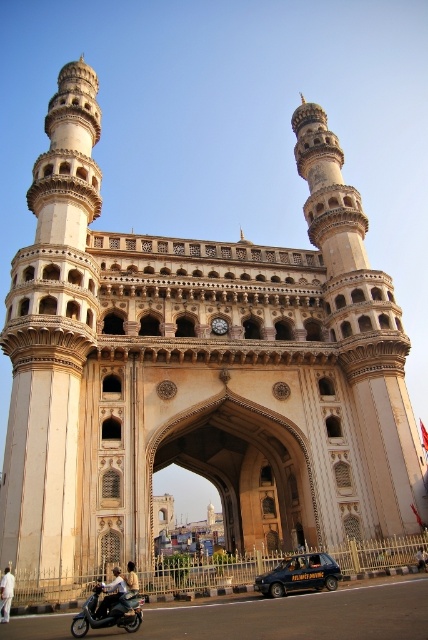
Based on the photo, is metallic silver scooter at lower left positioned in front of white cotton shirt at center?

Yes.

Does metallic silver scooter at lower left appear under white cotton shirt at center?

Yes, metallic silver scooter at lower left is below white cotton shirt at center.

Does point (125, 589) come closer to viewer compared to point (5, 577)?

That is True.

Where is `metallic silver scooter at lower left`? metallic silver scooter at lower left is located at coordinates (112, 604).

Is metallic silver scooter at lower left closer to camera compared to light blue fabric shirt at center?

Yes, metallic silver scooter at lower left is closer to the viewer.

Which is above, metallic silver scooter at lower left or light blue fabric shirt at center?

light blue fabric shirt at center

You are a GUI agent. You are given a task and a screenshot of the screen. Output one action in this format:
    pyautogui.click(x=<x>, y=<y>)
    Task: Click on the metallic silver scooter at lower left
    This screenshot has height=640, width=428.
    Given the screenshot: What is the action you would take?
    pyautogui.click(x=112, y=604)

Is light blue fabric shirt at center positioned at the back of white cotton shirt at center?

That is False.

Is point (115, 577) farther from camera compared to point (9, 593)?

Yes, it is behind point (9, 593).

Image resolution: width=428 pixels, height=640 pixels. Identify the location of light blue fabric shirt at center. (112, 593).